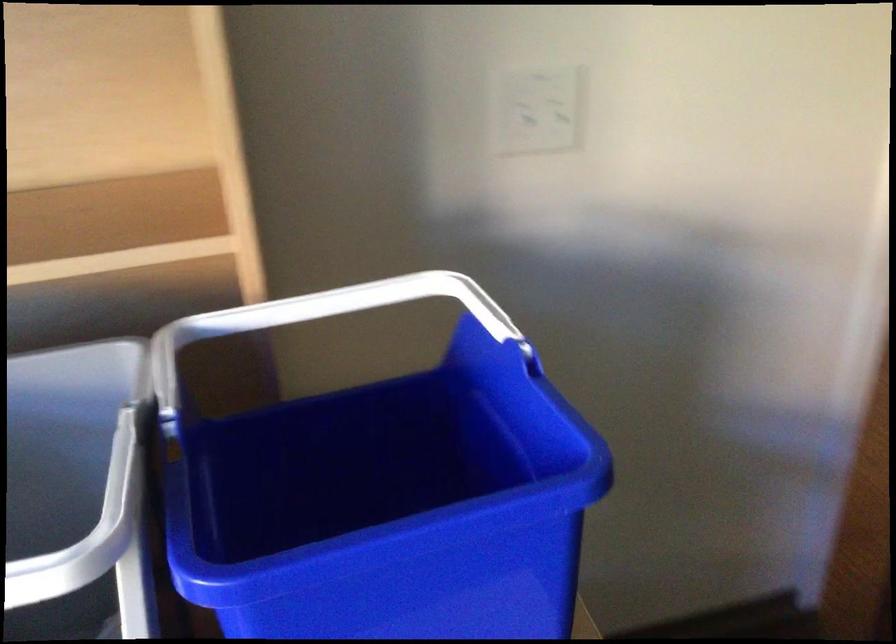
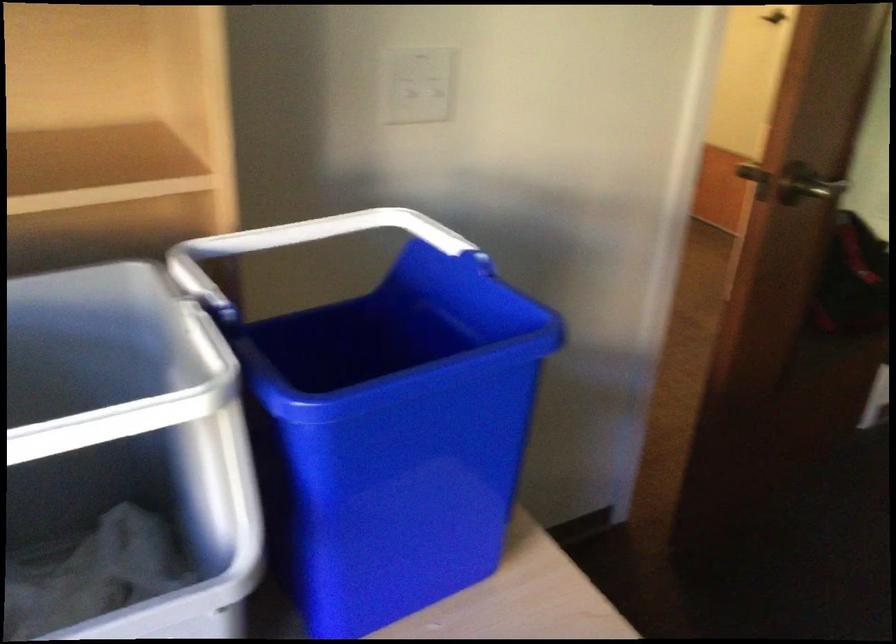
Question: The first image is from the beginning of the video and the second image is from the end. How did the camera likely rotate when shooting the video?

Choices:
 (A) Left
 (B) Right
 (C) Up
 (D) Down

Answer: (B)